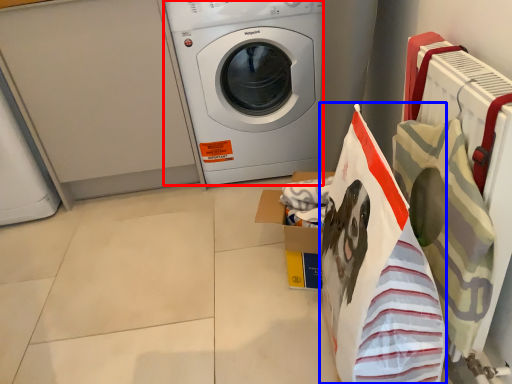
Question: Which object is further to the camera taking this photo, washing machine (highlighted by a red box) or shopping bag (highlighted by a blue box)?

Choices:
 (A) washing machine
 (B) shopping bag

Answer: (A)